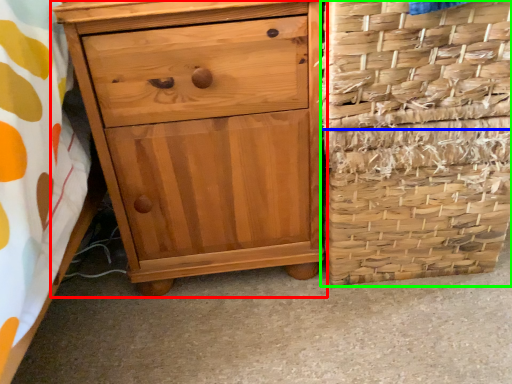
Question: Estimate the real-world distances between objects in this image. Which object is farther from chest of drawers (highlighted by a red box), basket (highlighted by a blue box) or basket container (highlighted by a green box)?

Choices:
 (A) basket
 (B) basket container

Answer: (A)